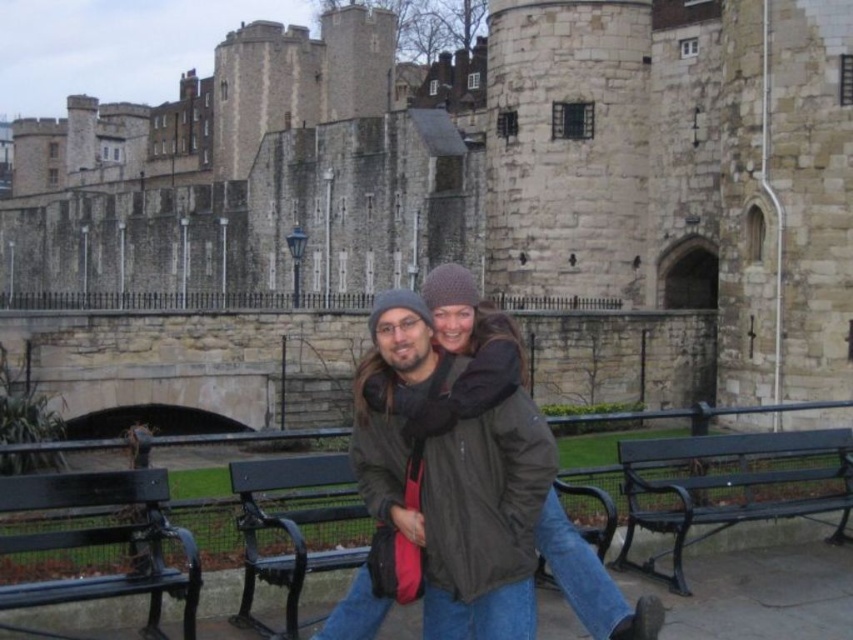
You are standing in front of the historic stone structure and see the dark brown leather jacket at center and the black metal bench at center. Which object is positioned to the right side from your perspective?

The dark brown leather jacket at center is to the right of the black metal bench at center.

You are standing in front of the historic stone structure and notice the dark brown leather jacket at center. If you were to draw a straight line from your current position to the jacket, what would be the coordinates of the point where this line intersects the arched gateway on the right side?

The coordinates of the intersection point cannot be determined with the provided information.